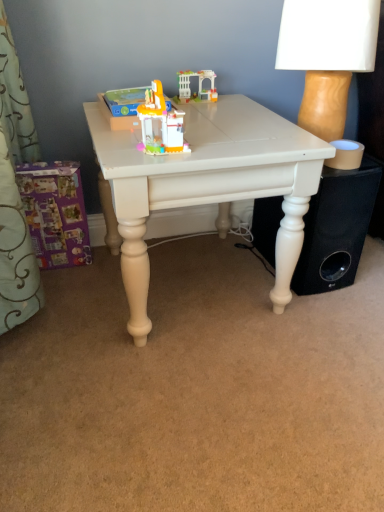
Locate an element on the screen. vacant space that's between black matte speaker at lower right and purple cardboard box at lower left, which is the fourth toy from top to bottom is located at coordinates (192, 271).